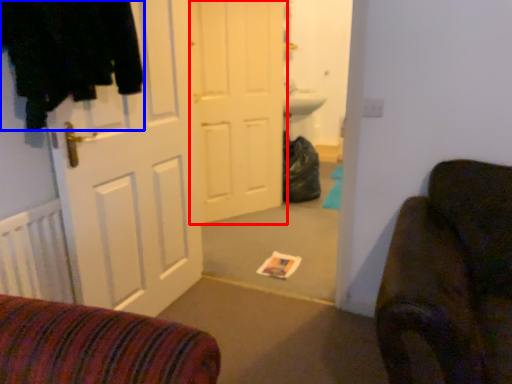
Question: Among these objects, which one is nearest to the camera, door (highlighted by a red box) or clothing (highlighted by a blue box)?

Choices:
 (A) door
 (B) clothing

Answer: (B)